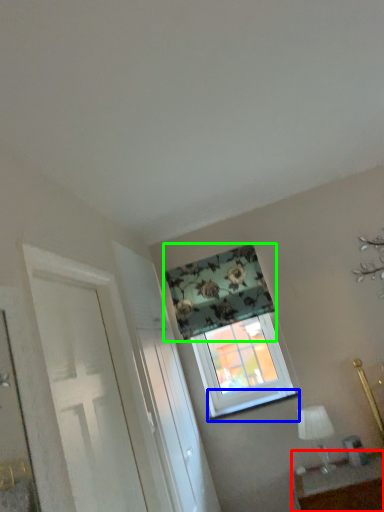
Question: Based on their relative distances, which object is nearer to table (highlighted by a red box)? Choose from window sill (highlighted by a blue box) and curtain (highlighted by a green box).

Choices:
 (A) window sill
 (B) curtain

Answer: (A)